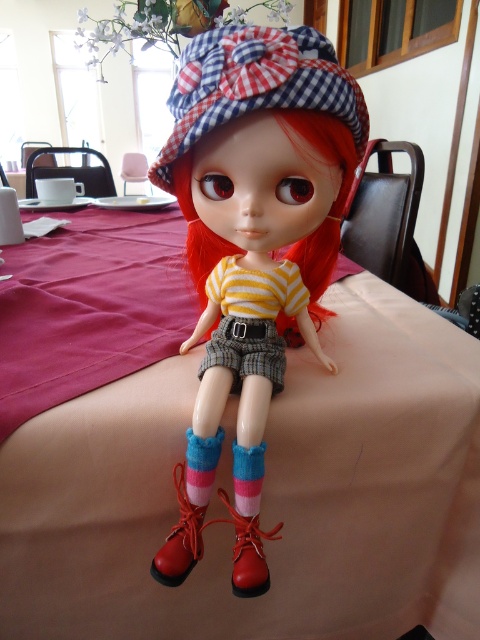
Question: Which point is closer to the camera?

Choices:
 (A) knitted wool socks at center
 (B) matte plastic doll at center

Answer: (B)

Question: Which point is farther to the camera?

Choices:
 (A) matte red boot at center
 (B) knitted pink and blue socks at lower center
 (C) red silky hair at center
 (D) shiny red boot at lower center

Answer: (B)

Question: Does beige fabric table at center lie in front of matte red boot at center?

Choices:
 (A) yes
 (B) no

Answer: (B)

Question: Is the position of beige fabric table at center more distant than that of matte red boot at center?

Choices:
 (A) no
 (B) yes

Answer: (B)

Question: Which point is closer to the camera taking this photo?

Choices:
 (A) (226, 500)
 (B) (165, 561)

Answer: (B)

Question: Does matte red boot at center have a larger size compared to knitted wool socks at center?

Choices:
 (A) no
 (B) yes

Answer: (B)